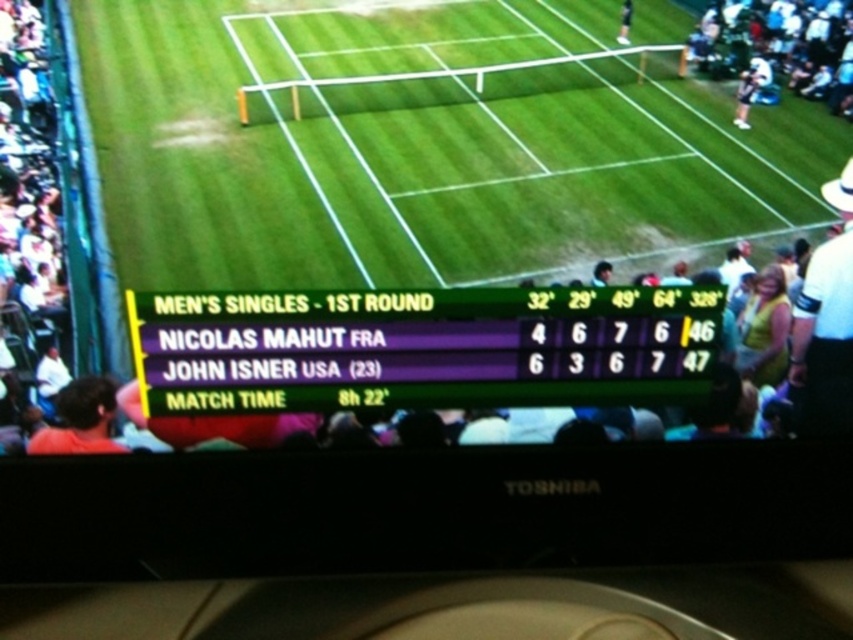
From the picture: What is the location of the green grass tennis court at center in the image?

The green grass tennis court at center is located at point (422,148).

Based on the photo, you are a spectator at the tennis match and want to locate the two players. Which object in the image is positioned higher up between the white hat at upper right and the brown hair at lower left?

The white hat at upper right is positioned higher up than the brown hair at lower left.

You are a spectator at the tennis match and want to take a photo of the brown hair at lower left without the green grass tennis court at center blocking the view. Is this possible?

The brown hair at lower left is behind the green grass tennis court at center, so it is blocked by the court and cannot be seen without the court obstructing the view.